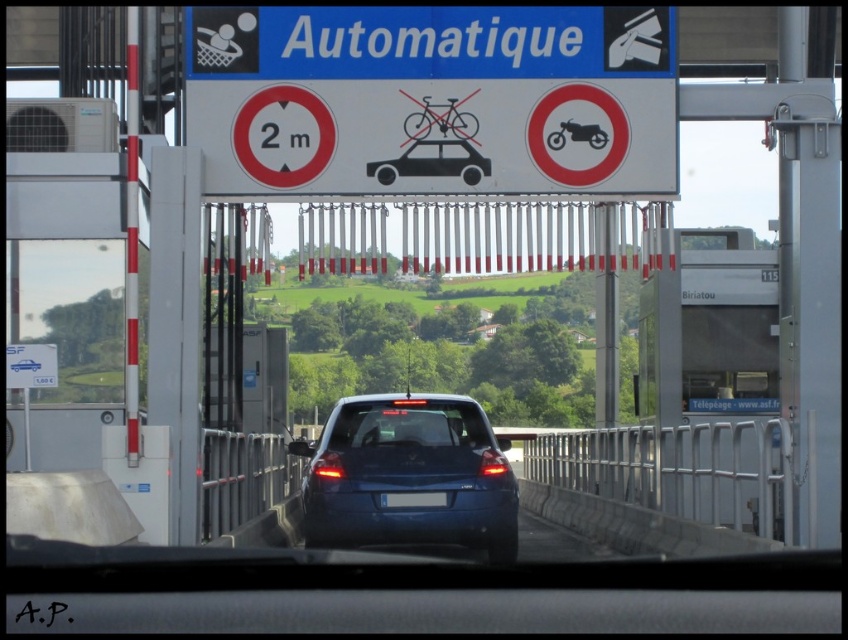
Question: Does blue matte car at center appear on the right side of gray metallic barrier at center?

Choices:
 (A) yes
 (B) no

Answer: (B)

Question: Which of the following is the closest to the observer?

Choices:
 (A) (462, 524)
 (B) (590, 493)

Answer: (A)

Question: Which point is farther to the camera?

Choices:
 (A) blue matte car at center
 (B) blue plastic license plate at center

Answer: (B)

Question: Does blue matte car at center have a larger size compared to blue plastic license plate at center?

Choices:
 (A) yes
 (B) no

Answer: (A)

Question: Considering the real-world distances, which object is farthest from the blue matte car at center?

Choices:
 (A) gray metallic barrier at center
 (B) blue plastic license plate at center

Answer: (A)

Question: Can you confirm if gray metallic barrier at center is bigger than blue plastic license plate at center?

Choices:
 (A) yes
 (B) no

Answer: (A)